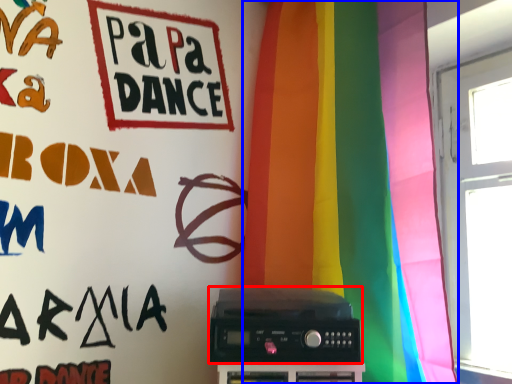
Question: Which point is closer to the camera, amplifier (highlighted by a red box) or curtain (highlighted by a blue box)?

Choices:
 (A) amplifier
 (B) curtain

Answer: (B)